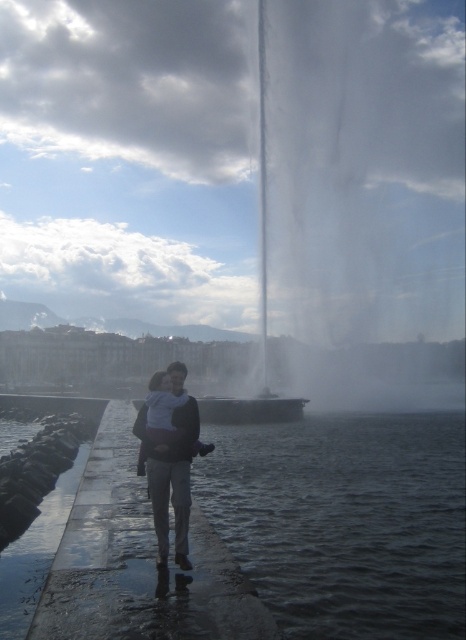
This screenshot has height=640, width=466. What do you see at coordinates (275, 541) in the screenshot? I see `clear water at pier center` at bounding box center [275, 541].

Between clear water at pier center and white soft baby at center, which one is positioned lower?

clear water at pier center is lower down.

Does point (411, 458) come closer to viewer compared to point (155, 381)?

No, it is behind (155, 381).

Identify the location of clear water at pier center. The width and height of the screenshot is (466, 640). (x=275, y=541).

Can you confirm if clear water at pier center is positioned to the right of matte black jacket at center?

Indeed, clear water at pier center is positioned on the right side of matte black jacket at center.

Does clear water at pier center have a lesser width compared to matte black jacket at center?

In fact, clear water at pier center might be wider than matte black jacket at center.

Is point (64, 570) positioned before point (157, 445)?

Yes, it is.

Where is `clear water at pier center`? clear water at pier center is located at coordinates (275, 541).

Who is more forward, [158,477] or [168,380]?

Point [158,477] is more forward.

Identify the location of matte black jacket at center. (170, 476).